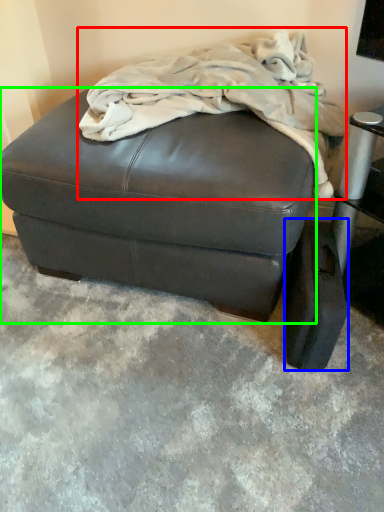
Question: Estimate the real-world distances between objects in this image. Which object is farther from blanket (highlighted by a red box), pad (highlighted by a blue box) or furniture (highlighted by a green box)?

Choices:
 (A) pad
 (B) furniture

Answer: (A)